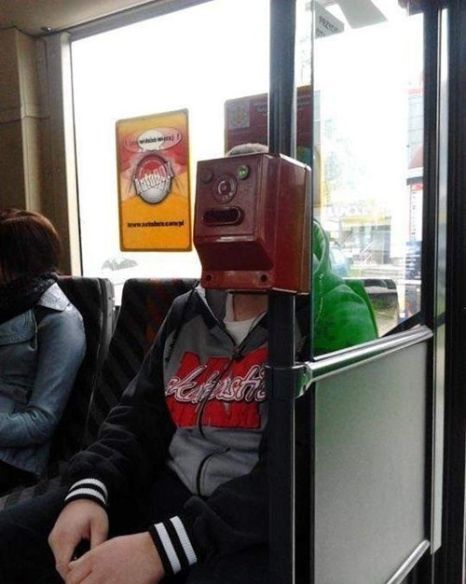
Where is `seat`? The image size is (466, 584). seat is located at coordinates (99, 295).